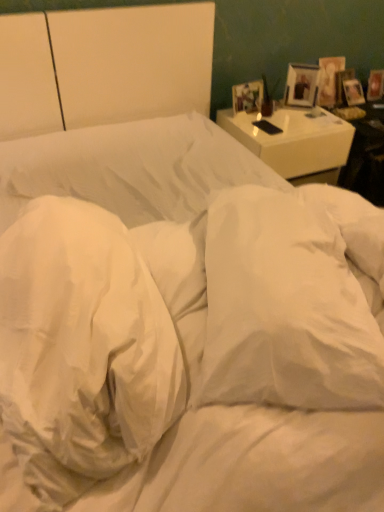
Image resolution: width=384 pixels, height=512 pixels. Describe the element at coordinates (285, 308) in the screenshot. I see `white soft pillow at center, positioned as the 1th pillow in right-to-left order` at that location.

Locate an element on the screen. wooden picture frame at upper right, which is the 2th picture frame in left-to-right order is located at coordinates [302, 85].

In order to face matte wooden picture frame at upper right, which is counted as the third picture frame, starting from the back, should I rotate leftwards or rightwards?

Rotate right and turn 7.426 degrees.

I want to click on wooden picture frame at upper right, which appears as the third picture frame when viewed from the front, so click(375, 85).

How many degrees apart are the facing directions of wooden picture frame at upper right, which is the 2th picture frame in left-to-right order, and white soft pillow at center, the second pillow when ordered from right to left?

The facing directions of wooden picture frame at upper right, which is the 2th picture frame in left-to-right order, and white soft pillow at center, the second pillow when ordered from right to left, are 127 degrees apart.

Which point is more forward, (291,99) or (89,404)?

The point (89,404) is in front.

Can you confirm if wooden picture frame at upper right, the second picture frame when ordered from front to back, is thinner than white soft pillow at center, acting as the 1th pillow starting from the left?

Yes.

Visually, is wooden picture frame at upper right, which is the 2th picture frame in left-to-right order, positioned to the left or to the right of white soft pillow at center, the second pillow when ordered from right to left?

In the image, wooden picture frame at upper right, which is the 2th picture frame in left-to-right order, appears on the right side of white soft pillow at center, the second pillow when ordered from right to left.

Are white glossy nightstand at upper right and matte wooden picture frame at upper right, which ranks as the 1th picture frame in left-to-right order, beside each other?

white glossy nightstand at upper right and matte wooden picture frame at upper right, which ranks as the 1th picture frame in left-to-right order, are not in contact.

Considering the positions of point (311, 176) and point (259, 94), is point (311, 176) closer or farther from the camera than point (259, 94)?

Clearly, point (311, 176) is closer to the camera than point (259, 94).

How many degrees apart are the facing directions of white glossy nightstand at upper right and matte wooden picture frame at upper right, placed as the third picture frame when sorted from right to left?

The angular difference between white glossy nightstand at upper right and matte wooden picture frame at upper right, placed as the third picture frame when sorted from right to left, is 7.37 degrees.

Is white glossy nightstand at upper right at the right side of matte wooden picture frame at upper right, which ranks as the 1th picture frame in left-to-right order?

Correct, you'll find white glossy nightstand at upper right to the right of matte wooden picture frame at upper right, which ranks as the 1th picture frame in left-to-right order.

Does white soft pillow at center, acting as the 1th pillow starting from the left, have a lesser height compared to white soft pillow at center, marked as the 2th pillow in a left-to-right arrangement?

No.

Is point (12, 238) closer or farther from the camera than point (204, 362)?

Point (12, 238) appears to be farther away from the viewer than point (204, 362).

Is white soft pillow at center, the second pillow when ordered from right to left, behind white soft pillow at center, positioned as the 1th pillow in right-to-left order?

No, the depth of white soft pillow at center, the second pillow when ordered from right to left, is less than that of white soft pillow at center, positioned as the 1th pillow in right-to-left order.

Can you tell me how much wooden picture frame at upper right, which is counted as the 2th picture frame, starting from the right, and matte wooden picture frame at upper right, which is the first picture frame from front to back, differ in facing direction?

The angular difference between wooden picture frame at upper right, which is counted as the 2th picture frame, starting from the right, and matte wooden picture frame at upper right, which is the first picture frame from front to back, is 42.1 degrees.

Which is in front, wooden picture frame at upper right, the 2th picture frame positioned from the back, or matte wooden picture frame at upper right, which is the first picture frame from front to back?

matte wooden picture frame at upper right, which is the first picture frame from front to back, is more forward.

Can we say wooden picture frame at upper right, which is the 2th picture frame in left-to-right order, lies outside matte wooden picture frame at upper right, which is the first picture frame from front to back?

Yes.

Which is more to the left, wooden picture frame at upper right, the 2th picture frame positioned from the back, or matte wooden picture frame at upper right, placed as the third picture frame when sorted from right to left?

Positioned to the left is matte wooden picture frame at upper right, placed as the third picture frame when sorted from right to left.

Which is correct: wooden picture frame at upper right, arranged as the first picture frame when viewed from the right, is inside white soft pillow at center, acting as the 1th pillow starting from the left, or outside of it?

wooden picture frame at upper right, arranged as the first picture frame when viewed from the right, cannot be found inside white soft pillow at center, acting as the 1th pillow starting from the left.

From a real-world perspective, is wooden picture frame at upper right, which is the third picture frame in left-to-right order, physically located above or below white soft pillow at center, acting as the 1th pillow starting from the left?

From a real-world perspective, wooden picture frame at upper right, which is the third picture frame in left-to-right order, is physically below white soft pillow at center, acting as the 1th pillow starting from the left.

Consider the image. Between wooden picture frame at upper right, the 1th picture frame in the back-to-front sequence, and white soft pillow at center, the second pillow when ordered from right to left, which one is positioned in front?

Positioned in front is white soft pillow at center, the second pillow when ordered from right to left.

Between point (367, 88) and point (124, 330), which one is positioned in front?

The point (124, 330) is closer to the camera.

Identify the location of picture frame that is the 1st one above the wooden picture frame at upper right, which is the third picture frame in left-to-right order (from a real-world perspective). (247, 97).

Would you say matte wooden picture frame at upper right, which ranks as the 1th picture frame in left-to-right order, is to the left or to the right of wooden picture frame at upper right, arranged as the first picture frame when viewed from the right, in the picture?

matte wooden picture frame at upper right, which ranks as the 1th picture frame in left-to-right order, is to the left of wooden picture frame at upper right, arranged as the first picture frame when viewed from the right.

Is matte wooden picture frame at upper right, which is counted as the third picture frame, starting from the back, turned away from wooden picture frame at upper right, which is the third picture frame in left-to-right order?

No, matte wooden picture frame at upper right, which is counted as the third picture frame, starting from the back,'s orientation is not away from wooden picture frame at upper right, which is the third picture frame in left-to-right order.

Does matte wooden picture frame at upper right, which is the first picture frame from front to back, have a smaller size compared to wooden picture frame at upper right, which appears as the third picture frame when viewed from the front?

Indeed, matte wooden picture frame at upper right, which is the first picture frame from front to back, has a smaller size compared to wooden picture frame at upper right, which appears as the third picture frame when viewed from the front.

Which object is positioned more to the left, white soft pillow at center, positioned as the 1th pillow in right-to-left order, or white soft pillow at center, acting as the 1th pillow starting from the left?

white soft pillow at center, acting as the 1th pillow starting from the left, is more to the left.

Is white soft pillow at center, positioned as the 1th pillow in right-to-left order, spatially inside white soft pillow at center, the second pillow when ordered from right to left, or outside of it?

white soft pillow at center, positioned as the 1th pillow in right-to-left order, is not enclosed by white soft pillow at center, the second pillow when ordered from right to left.

At what (x,y) coordinates should I click in order to perform the action: click on pillow in front of the white soft pillow at center, marked as the 2th pillow in a left-to-right arrangement. Please return your answer as a coordinate pair (x, y). The width and height of the screenshot is (384, 512). Looking at the image, I should click on (81, 349).

Starting from the white soft pillow at center, acting as the 1th pillow starting from the left, which picture frame is the 2nd one behind? Please provide its 2D coordinates.

[(302, 85)]

In the image, there is a matte wooden picture frame at upper right, which is counted as the third picture frame, starting from the back. Identify the location of nightstand below it (from a real-world perspective). This screenshot has width=384, height=512. (295, 142).

When comparing their distances from white glossy nightstand at upper right, does matte wooden picture frame at upper right, which is the first picture frame from front to back, or white soft pillow at center, acting as the 1th pillow starting from the left, seem closer?

matte wooden picture frame at upper right, which is the first picture frame from front to back.

Estimate the real-world distances between objects in this image. Which object is further from matte wooden picture frame at upper right, placed as the third picture frame when sorted from right to left, white soft pillow at center, acting as the 1th pillow starting from the left, or white soft pillow at center, marked as the 2th pillow in a left-to-right arrangement?

The object further to matte wooden picture frame at upper right, placed as the third picture frame when sorted from right to left, is white soft pillow at center, acting as the 1th pillow starting from the left.

Considering their positions, is matte wooden picture frame at upper right, which ranks as the 1th picture frame in left-to-right order, positioned closer to white soft pillow at center, positioned as the 1th pillow in right-to-left order, than wooden picture frame at upper right, which is the third picture frame in left-to-right order?

Based on the image, matte wooden picture frame at upper right, which ranks as the 1th picture frame in left-to-right order, appears to be nearer to white soft pillow at center, positioned as the 1th pillow in right-to-left order.

Considering their positions, is wooden picture frame at upper right, which appears as the third picture frame when viewed from the front, positioned closer to white soft pillow at center, acting as the 1th pillow starting from the left, than wooden picture frame at upper right, which is the 2th picture frame in left-to-right order?

wooden picture frame at upper right, which is the 2th picture frame in left-to-right order, is closer to white soft pillow at center, acting as the 1th pillow starting from the left.

Based on their spatial positions, is white soft pillow at center, the second pillow when ordered from right to left, or white soft pillow at center, positioned as the 1th pillow in right-to-left order, closer to wooden picture frame at upper right, the 2th picture frame positioned from the back?

white soft pillow at center, positioned as the 1th pillow in right-to-left order, is closer to wooden picture frame at upper right, the 2th picture frame positioned from the back.

Considering their positions, is matte wooden picture frame at upper right, which is the first picture frame from front to back, positioned further to wooden picture frame at upper right, which is counted as the 2th picture frame, starting from the right, than white soft pillow at center, marked as the 2th pillow in a left-to-right arrangement?

The object further to wooden picture frame at upper right, which is counted as the 2th picture frame, starting from the right, is white soft pillow at center, marked as the 2th pillow in a left-to-right arrangement.

Based on the photo, estimate the real-world distances between objects in this image. Which object is closer to wooden picture frame at upper right, the 2th picture frame positioned from the back, wooden picture frame at upper right, arranged as the first picture frame when viewed from the right, or white soft pillow at center, acting as the 1th pillow starting from the left?

wooden picture frame at upper right, arranged as the first picture frame when viewed from the right.

From the image, which object appears to be farther from white glossy nightstand at upper right, white soft pillow at center, acting as the 1th pillow starting from the left, or white soft pillow at center, positioned as the 1th pillow in right-to-left order?

Based on the image, white soft pillow at center, acting as the 1th pillow starting from the left, appears to be further to white glossy nightstand at upper right.

Identify the location of pillow between white soft pillow at center, the second pillow when ordered from right to left, and white glossy nightstand at upper right from front to back. (285, 308).

Where is `pillow located between white soft pillow at center, acting as the 1th pillow starting from the left, and wooden picture frame at upper right, which appears as the third picture frame when viewed from the front, in the depth direction`? This screenshot has height=512, width=384. pillow located between white soft pillow at center, acting as the 1th pillow starting from the left, and wooden picture frame at upper right, which appears as the third picture frame when viewed from the front, in the depth direction is located at coordinates (285, 308).

You are a GUI agent. You are given a task and a screenshot of the screen. Output one action in this format:
    pyautogui.click(x=<x>, y=<y>)
    Task: Click on the nightstand between white soft pillow at center, marked as the 2th pillow in a left-to-right arrangement, and wooden picture frame at upper right, the 1th picture frame in the back-to-front sequence, in the front-back direction
    This screenshot has width=384, height=512.
    Given the screenshot: What is the action you would take?
    pyautogui.click(x=295, y=142)

This screenshot has height=512, width=384. Identify the location of nightstand between white soft pillow at center, positioned as the 1th pillow in right-to-left order, and matte wooden picture frame at upper right, placed as the third picture frame when sorted from right to left, along the z-axis. (295, 142).